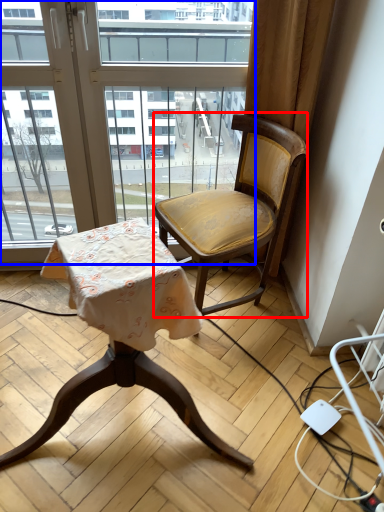
Question: Which object is closer to the camera taking this photo, chair (highlighted by a red box) or window (highlighted by a blue box)?

Choices:
 (A) chair
 (B) window

Answer: (A)